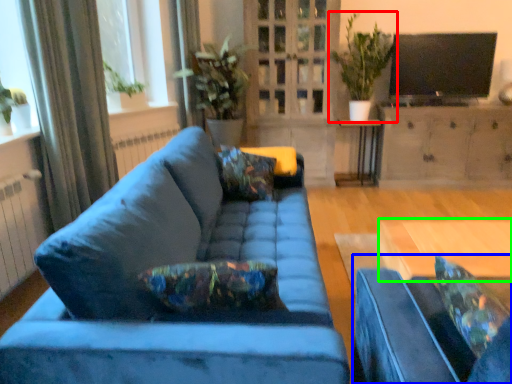
Question: Which object is the farthest from houseplant (highlighted by a red box)? Choose among these: studio couch (highlighted by a blue box) or desk (highlighted by a green box).

Choices:
 (A) studio couch
 (B) desk

Answer: (A)